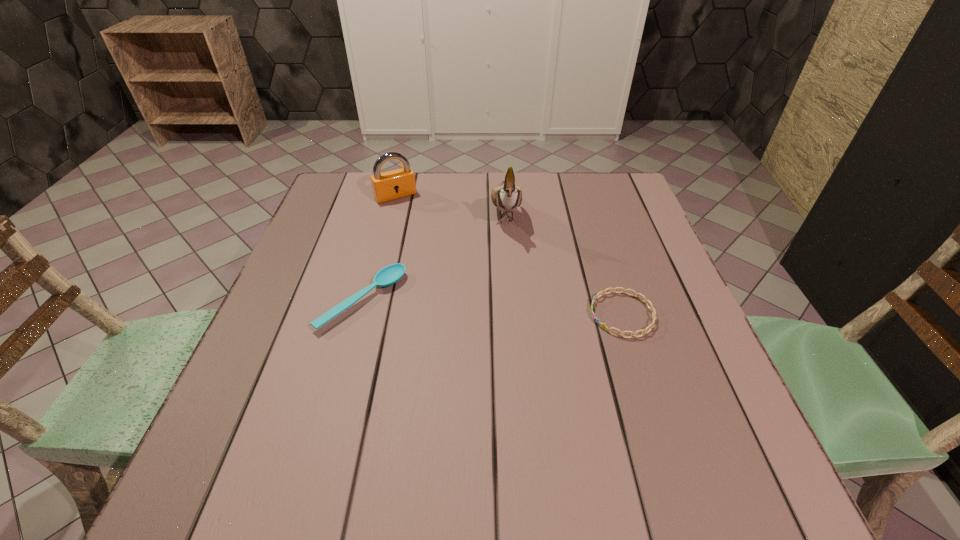
Where is `object that is at the far left corner`? object that is at the far left corner is located at coordinates (394, 184).

This screenshot has width=960, height=540. In order to click on free space at the far edge of the desktop in this screenshot , I will do `click(536, 188)`.

I want to click on free space at the near edge, so click(x=535, y=428).

The height and width of the screenshot is (540, 960). In the image, there is a desktop. Find the location of `vacant space at the left edge`. vacant space at the left edge is located at coordinates (337, 291).

The image size is (960, 540). What are the coordinates of `vacant point at the right edge` in the screenshot? It's located at (598, 221).

Locate an element on the screen. free spot at the far left corner of the desktop is located at coordinates click(324, 199).

Image resolution: width=960 pixels, height=540 pixels. In order to click on free space at the far right corner of the desktop in this screenshot , I will do `click(613, 193)`.

You are a GUI agent. You are given a task and a screenshot of the screen. Output one action in this format:
    pyautogui.click(x=<x>, y=<y>)
    Task: Click on the vacant space that's between the spoon and the rightmost object
    Image resolution: width=960 pixels, height=540 pixels.
    Given the screenshot: What is the action you would take?
    pyautogui.click(x=492, y=307)

Identify the location of free spot between the padlock and the spoon. The width and height of the screenshot is (960, 540). (379, 248).

Locate an element on the screen. This screenshot has width=960, height=540. free spot between the second tallest object and the tallest object is located at coordinates (450, 204).